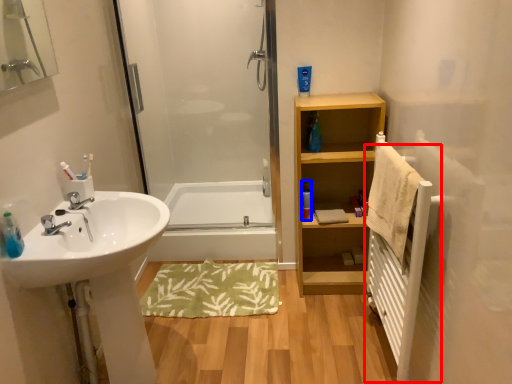
Question: Which point is closer to the camera, radiator (highlighted by a red box) or toiletry (highlighted by a blue box)?

Choices:
 (A) radiator
 (B) toiletry

Answer: (A)